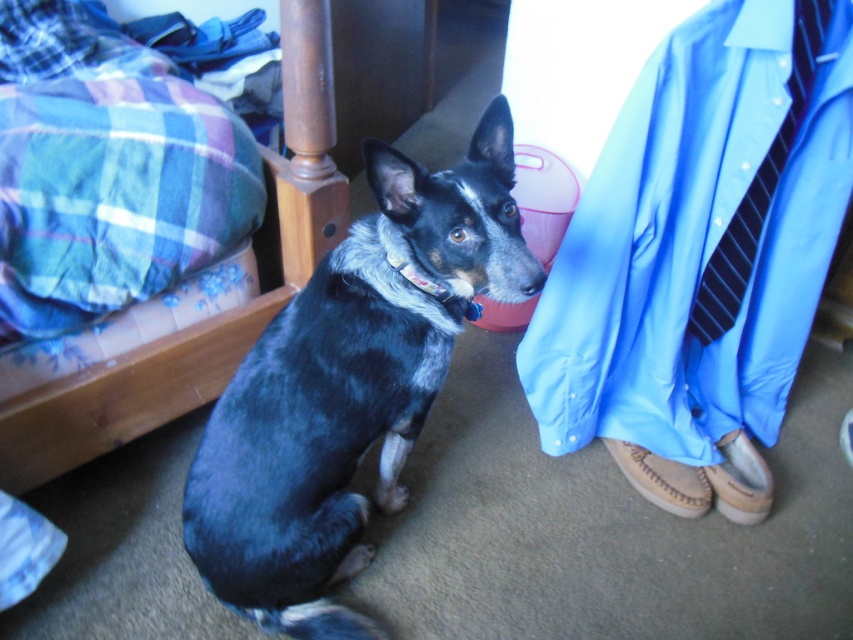
You are standing in the room and want to know which of the two points, point (x=184, y=516) or point (x=722, y=451), is closer to you. Can you determine this based on their positions?

Point (x=184, y=516) is closer to the viewer than point (x=722, y=451), so it is closer to you.

In the image, there is a blue plaid blanket on the left and a wooden headboard on the right. Where is the point at coordinates (349, 385) located in relation to these objects?

The point at coordinates (349, 385) marks the blue black fur dog at center, which is positioned between the blue plaid blanket on the left and the wooden headboard on the right.

You are a photographer setting up a shoot in this room. You want to position a small stool between the plaid fabric bed at left and the brown suede sandal at lower right. Based on their positions, which object should the stool be closer to?

The stool should be closer to the brown suede sandal at lower right because the plaid fabric bed at left is closer to the viewer, meaning the sandal is further back, so placing the stool closer to the sandal would maintain balance between the foreground and background elements.